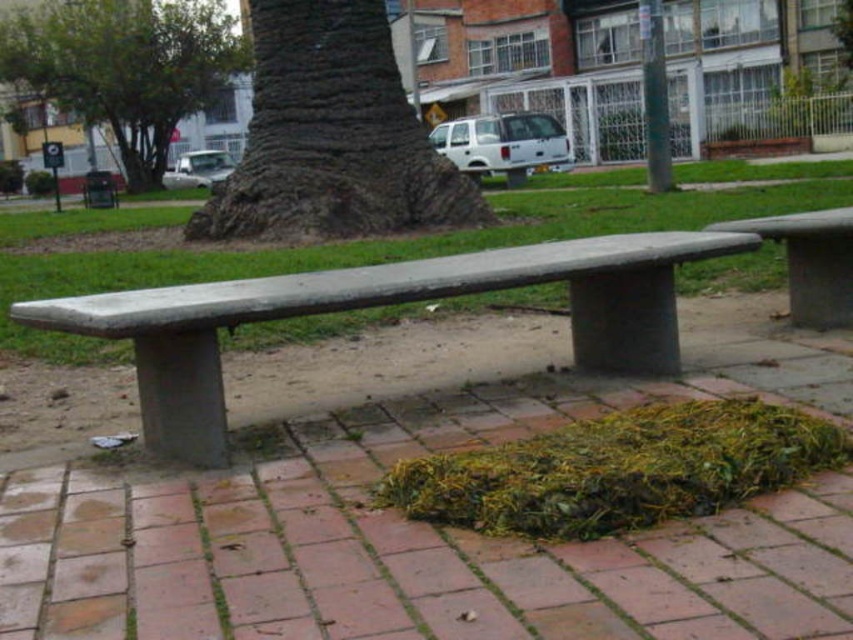
Question: Does green grass at center appear on the right side of brown rough bark at center?

Choices:
 (A) yes
 (B) no

Answer: (B)

Question: Where is gray concrete bench at center located in relation to green leafy tree at upper left in the image?

Choices:
 (A) right
 (B) left

Answer: (A)

Question: Which object is farther from the camera taking this photo?

Choices:
 (A) green leafy tree at upper left
 (B) smooth concrete bench at right
 (C) brown rough bark at center

Answer: (A)

Question: Can you confirm if gray concrete bench at center is wider than green grass at center?

Choices:
 (A) yes
 (B) no

Answer: (B)

Question: Considering the real-world distances, which object is closest to the smooth concrete bench at center?

Choices:
 (A) green leafy tree at upper left
 (B) green grass at center
 (C) gray concrete bench at center
 (D) smooth concrete bench at right

Answer: (C)

Question: Estimate the real-world distances between objects in this image. Which object is closer to the green grass at center?

Choices:
 (A) gray concrete bench at center
 (B) smooth concrete bench at center
 (C) brown rough bark at center
 (D) smooth concrete bench at right

Answer: (A)